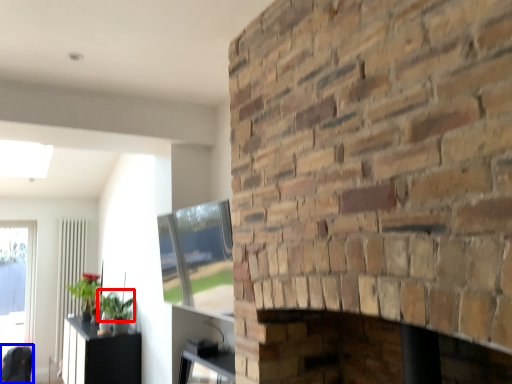
Question: Which object appears farthest to the camera in this image, plant (highlighted by a red box) or swivel chair (highlighted by a blue box)?

Choices:
 (A) plant
 (B) swivel chair

Answer: (B)